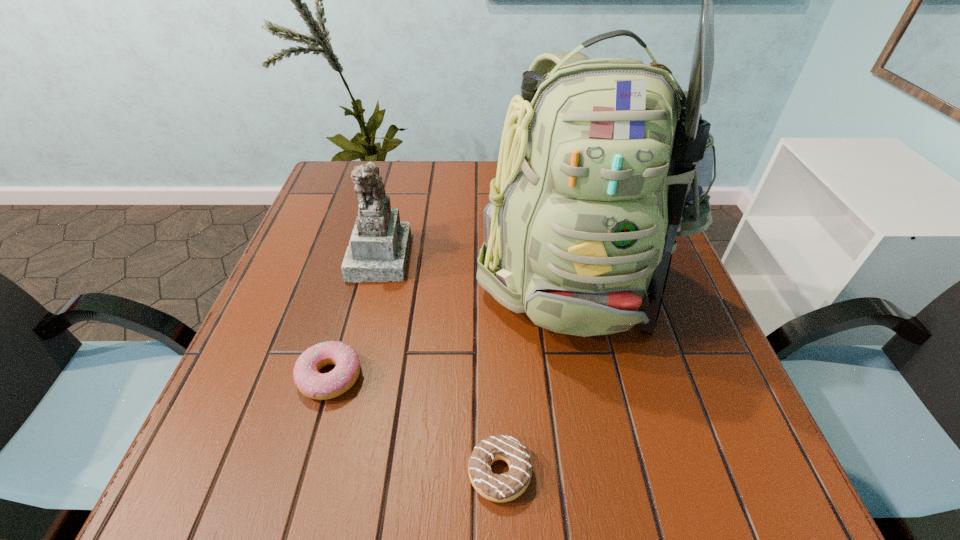
Image resolution: width=960 pixels, height=540 pixels. I want to click on object that is positioned at the near edge, so click(x=508, y=486).

Locate an element on the screen. The width and height of the screenshot is (960, 540). figurine that is at the left edge is located at coordinates (378, 249).

Find the location of a particular element. The width and height of the screenshot is (960, 540). doughnut that is at the left edge is located at coordinates (311, 383).

This screenshot has height=540, width=960. What are the coordinates of `object that is at the right edge` in the screenshot? It's located at (603, 162).

Locate an element on the screen. The height and width of the screenshot is (540, 960). vacant region at the far edge of the desktop is located at coordinates (392, 184).

The height and width of the screenshot is (540, 960). Identify the location of vacant area at the near edge of the desktop. pos(576,489).

This screenshot has height=540, width=960. Find the location of `vacant position at the left edge of the desktop`. vacant position at the left edge of the desktop is located at coordinates (335, 231).

Where is `vacant space at the right edge of the desktop`? vacant space at the right edge of the desktop is located at coordinates (669, 411).

Find the location of a particular element. Image resolution: width=960 pixels, height=540 pixels. free point at the near left corner is located at coordinates (231, 472).

Find the location of a particular element. This screenshot has width=960, height=540. free space at the near right corner of the desktop is located at coordinates (707, 451).